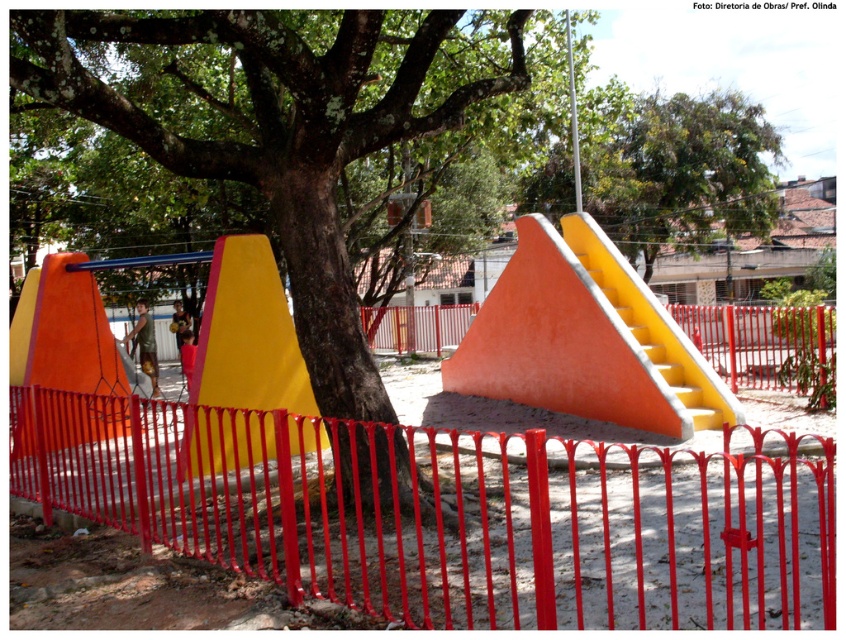
Is red metal fence at center thinner than green rough bark tree at center?

Incorrect, red metal fence at center's width is not less than green rough bark tree at center's.

Is red metal fence at center further to camera compared to green rough bark tree at center?

No, red metal fence at center is closer to the viewer.

Locate an element on the screen. red metal fence at center is located at coordinates (451, 513).

Find the location of a particular element. The image size is (846, 640). red metal fence at center is located at coordinates (451, 513).

Identify the location of orange matte slide at center. (585, 339).

Is orange matte slide at center to the left of yellow matte slide at center from the viewer's perspective?

No, orange matte slide at center is not to the left of yellow matte slide at center.

Does point (493, 358) come behind point (191, 428)?

Yes, it is.

At what (x,y) coordinates should I click in order to perform the action: click on orange matte slide at center. Please return your answer as a coordinate pair (x, y). The width and height of the screenshot is (846, 640). Looking at the image, I should click on pos(585,339).

Is green rough bark tree at center shorter than green leafy tree at upper center?

Yes, green rough bark tree at center is shorter than green leafy tree at upper center.

Who is more distant from viewer, (x=429, y=12) or (x=619, y=212)?

The point (x=619, y=212) is more distant.

The image size is (846, 640). What are the coordinates of `green rough bark tree at center` in the screenshot? It's located at (273, 138).